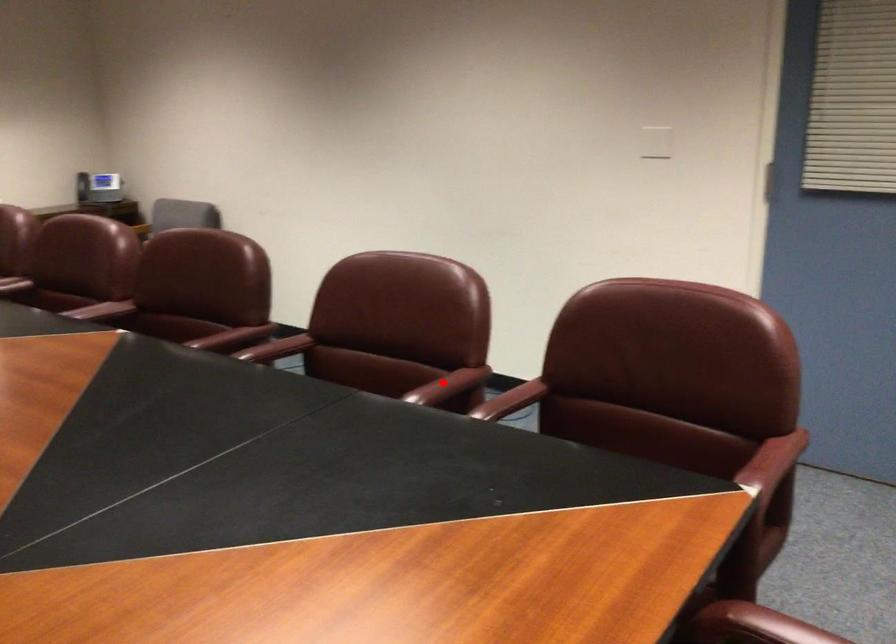
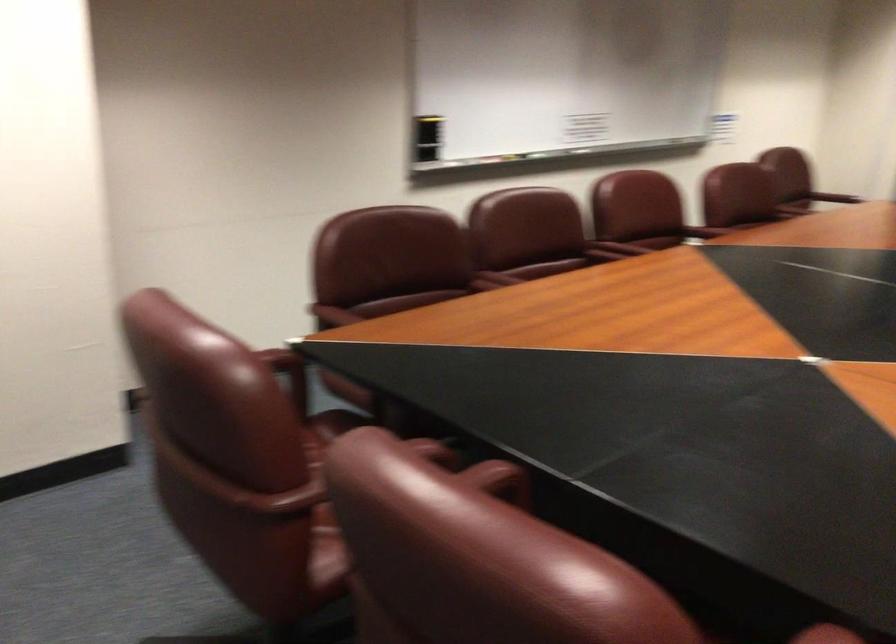
Question: I am providing you with two images of the same scene from different viewpoints. A red point is marked on the first image. Is the red point's position out of view in image 2?

Choices:
 (A) Yes
 (B) No

Answer: (B)